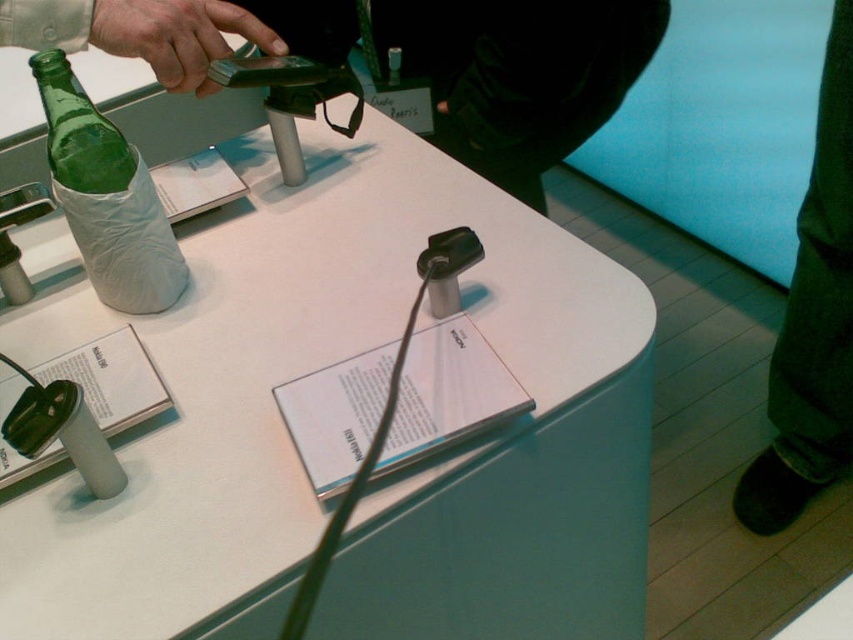
Question: Can you confirm if dark green pants at lower right is wider than green matte phone at upper left?

Choices:
 (A) no
 (B) yes

Answer: (B)

Question: Estimate the real-world distances between objects in this image. Which object is farther from the dark green pants at lower right?

Choices:
 (A) green matte phone at upper left
 (B) green glass bottle at left

Answer: (B)

Question: Can you confirm if green glass bottle at left is wider than green matte phone at upper left?

Choices:
 (A) yes
 (B) no

Answer: (B)

Question: Which object is the closest to the green matte phone at upper left?

Choices:
 (A) dark green pants at lower right
 (B) green glass bottle at left
 (C) white paper at center

Answer: (B)

Question: Can you confirm if green glass bottle at left is wider than green matte phone at upper left?

Choices:
 (A) no
 (B) yes

Answer: (A)

Question: Which point is farther to the camera?

Choices:
 (A) (190, 58)
 (B) (160, 340)
 (C) (102, 173)

Answer: (B)